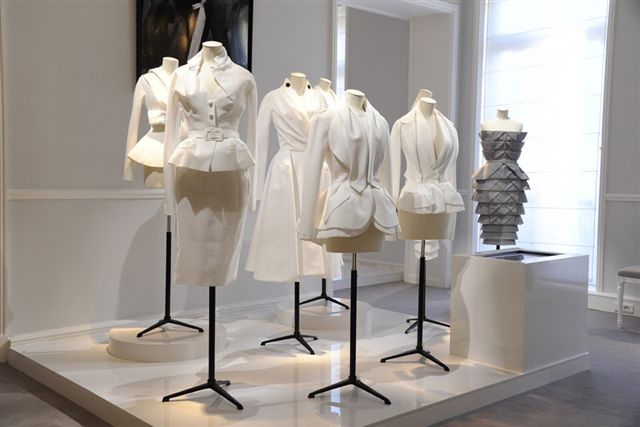
In order to click on stage in this screenshot , I will do `click(284, 385)`.